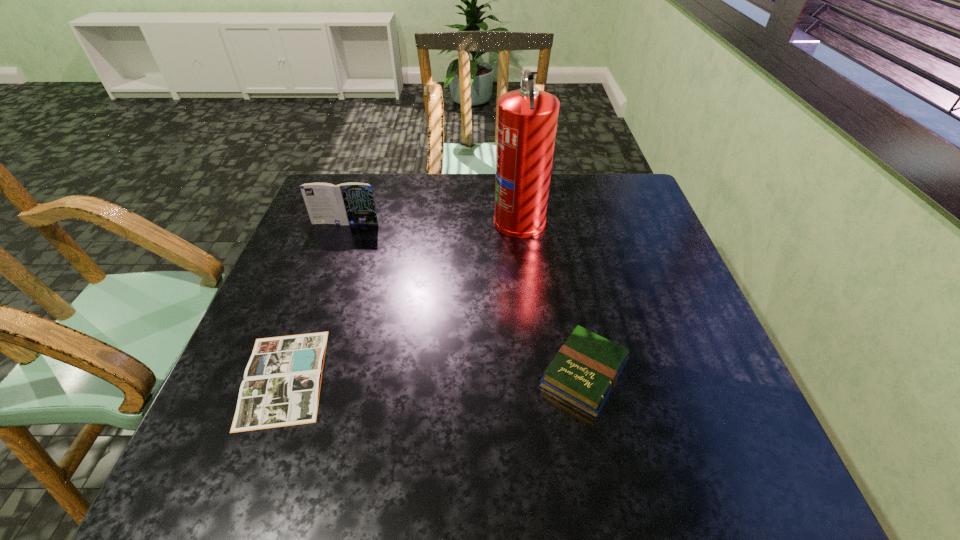
Where is `vacant space that satisfies the following two spatial constraints: 1. on the instruction side of the tallest object; 2. on the front cover of the third shortest object`? The image size is (960, 540). vacant space that satisfies the following two spatial constraints: 1. on the instruction side of the tallest object; 2. on the front cover of the third shortest object is located at coordinates (519, 223).

Find the location of a particular element. This screenshot has width=960, height=540. vacant space that satisfies the following two spatial constraints: 1. on the front cover of the third shortest object; 2. on the right side of the second shortest book is located at coordinates [x=292, y=374].